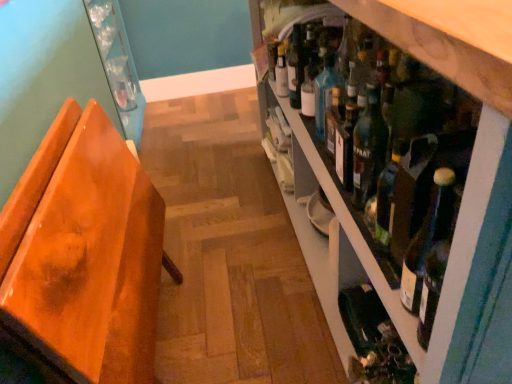
Describe the element at coordinates (84, 252) in the screenshot. I see `orange wood chair at left` at that location.

What is the approximate width of green glass bottles at right?

The width of green glass bottles at right is 26.23 inches.

Identify the location of green glass bottle at lower right. The image size is (512, 384). (373, 339).

This screenshot has width=512, height=384. Identify the location of white glass bottle at upper center. (281, 72).

At what (x,y) coordinates should I click in order to perform the action: click on orange wood chair at left. Please return your answer as a coordinate pair (x, y). Image resolution: width=512 pixels, height=384 pixels. Looking at the image, I should click on (84, 252).

From the picture: Is teal glass bottle at shelf center next to green glass bottle at lower right and touching it?

teal glass bottle at shelf center is not next to green glass bottle at lower right, and they're not touching.

Considering the relative sizes of teal glass bottle at shelf center and green glass bottle at lower right in the image provided, is teal glass bottle at shelf center shorter than green glass bottle at lower right?

No.

Is teal glass bottle at shelf center looking in the opposite direction of green glass bottle at lower right?

No.

Considering the relative positions of orange wood chair at left and white glass bottle at upper center in the image provided, is orange wood chair at left to the right of white glass bottle at upper center from the viewer's perspective?

In fact, orange wood chair at left is to the left of white glass bottle at upper center.

Who is smaller, orange wood chair at left or white glass bottle at upper center?

white glass bottle at upper center.

Is orange wood chair at left not near white glass bottle at upper center?

No, orange wood chair at left is not far away from white glass bottle at upper center.

Considering the sizes of orange wood chair at left and white glass bottle at upper center in the image, is orange wood chair at left taller or shorter than white glass bottle at upper center?

In the image, orange wood chair at left appears to be taller than white glass bottle at upper center.

Does point (375, 133) come closer to viewer compared to point (281, 64)?

That is True.

From a real-world perspective, which is physically above, green glass bottle at center right or white glass bottle at upper center?

In real-world perspective, green glass bottle at center right is above.

Would you say green glass bottle at center right contains white glass bottle at upper center?

That's incorrect, white glass bottle at upper center is not inside green glass bottle at center right.

Could you tell me if green glass bottle at center right is facing white glass bottle at upper center?

No, green glass bottle at center right is not facing towards white glass bottle at upper center.

Is green glass bottle at center right facing towards green glass bottles at right?

Yes, green glass bottle at center right faces towards green glass bottles at right.

Looking at this image, from the image's perspective, is green glass bottle at center right over green glass bottles at right?

No.

From a real-world perspective, between green glass bottle at center right and green glass bottles at right, who is vertically higher?

In real-world perspective, green glass bottle at center right is above.

Based on their positions, is green glass bottles at right located to the left or right of teal glass bottle at shelf center?

In the image, green glass bottles at right appears on the right side of teal glass bottle at shelf center.

From a real-world perspective, between green glass bottles at right and teal glass bottle at shelf center, who is vertically higher?

In real-world perspective, teal glass bottle at shelf center is above.

Is green glass bottles at right taller or shorter than teal glass bottle at shelf center?

Clearly, green glass bottles at right is taller compared to teal glass bottle at shelf center.

Is teal glass bottle at shelf center surrounded by green glass bottles at right?

That's correct, teal glass bottle at shelf center is inside green glass bottles at right.

Is green glass bottles at right far away from green glass bottle at lower right?

No, green glass bottles at right is not far from green glass bottle at lower right.

Does green glass bottles at right lie in front of green glass bottle at lower right?

Yes, green glass bottles at right is closer to the camera.

Is green glass bottles at right wider or thinner than green glass bottle at lower right?

green glass bottles at right is wider than green glass bottle at lower right.

From a real-world perspective, is green glass bottles at right under green glass bottle at lower right?

No, from a real-world perspective, green glass bottles at right is not beneath green glass bottle at lower right.

What's the angular difference between white glass bottle at upper center and orange wood chair at left's facing directions?

179 degrees separate the facing orientations of white glass bottle at upper center and orange wood chair at left.

From a real-world perspective, is white glass bottle at upper center physically below orange wood chair at left?

No, from a real-world perspective, white glass bottle at upper center is not below orange wood chair at left.

Is white glass bottle at upper center shorter than orange wood chair at left?

Correct, white glass bottle at upper center is not as tall as orange wood chair at left.

From the image's perspective, is white glass bottle at upper center located above or below orange wood chair at left?

Clearly, from the image's perspective, white glass bottle at upper center is above orange wood chair at left.

Where is `wine bottle that appears below the teal glass bottle at shelf center (from the image's perspective)`? The width and height of the screenshot is (512, 384). wine bottle that appears below the teal glass bottle at shelf center (from the image's perspective) is located at coordinates (373, 339).

The image size is (512, 384). I want to click on chair on the left of white glass bottle at upper center, so click(84, 252).

Which object lies further to the anchor point green glass bottle at center right, green glass bottle at lower right or orange wood chair at left?

Among the two, orange wood chair at left is located further to green glass bottle at center right.

Considering their positions, is green glass bottle at lower right positioned closer to green glass bottles at right than orange wood chair at left?

green glass bottle at lower right.

Considering their positions, is green glass bottles at right positioned further to green glass bottle at lower right than white glass bottle at upper center?

Based on the image, white glass bottle at upper center appears to be further to green glass bottle at lower right.

Based on their spatial positions, is green glass bottles at right or orange wood chair at left further from teal glass bottle at shelf center?

Among the two, orange wood chair at left is located further to teal glass bottle at shelf center.

Based on their spatial positions, is green glass bottles at right or white glass bottle at upper center closer to green glass bottle at center right?

green glass bottles at right is positioned closer to the anchor green glass bottle at center right.

Estimate the real-world distances between objects in this image. Which object is further from green glass bottle at lower right, white glass bottle at upper center or green glass bottles at right?

Based on the image, white glass bottle at upper center appears to be further to green glass bottle at lower right.

Looking at the image, which one is located further to white glass bottle at upper center, green glass bottle at center right or green glass bottle at lower right?

green glass bottle at lower right is further to white glass bottle at upper center.

From the image, which object appears to be farther from teal glass bottle at shelf center, green glass bottle at center right or green glass bottle at lower right?

The object further to teal glass bottle at shelf center is green glass bottle at lower right.

The width and height of the screenshot is (512, 384). Find the location of `teal between orange wood chair at left and green glass bottle at center right in the horizontal direction`. teal between orange wood chair at left and green glass bottle at center right in the horizontal direction is located at coordinates (326, 91).

You are a GUI agent. You are given a task and a screenshot of the screen. Output one action in this format:
    pyautogui.click(x=<x>, y=<y>)
    Task: Click on the wine bottle between green glass bottles at right and white glass bottle at upper center from front to back
    The height and width of the screenshot is (384, 512).
    Given the screenshot: What is the action you would take?
    pyautogui.click(x=373, y=339)

Identify the location of wine positioned between green glass bottles at right and white glass bottle at upper center from near to far. (368, 147).

Locate an element on the screen. Image resolution: width=512 pixels, height=384 pixels. wine that lies between white glass bottle at upper center and green glass bottle at lower right from top to bottom is located at coordinates (368, 147).